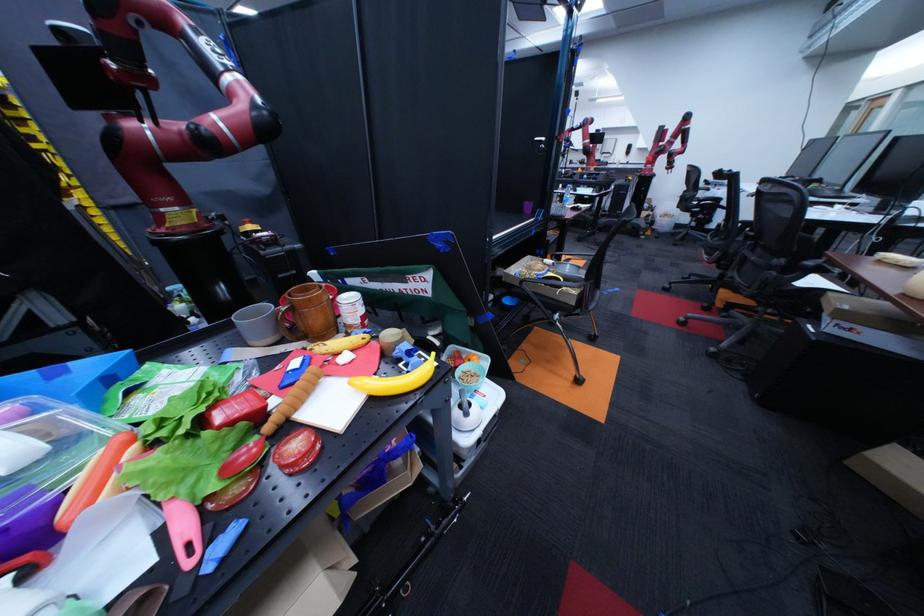
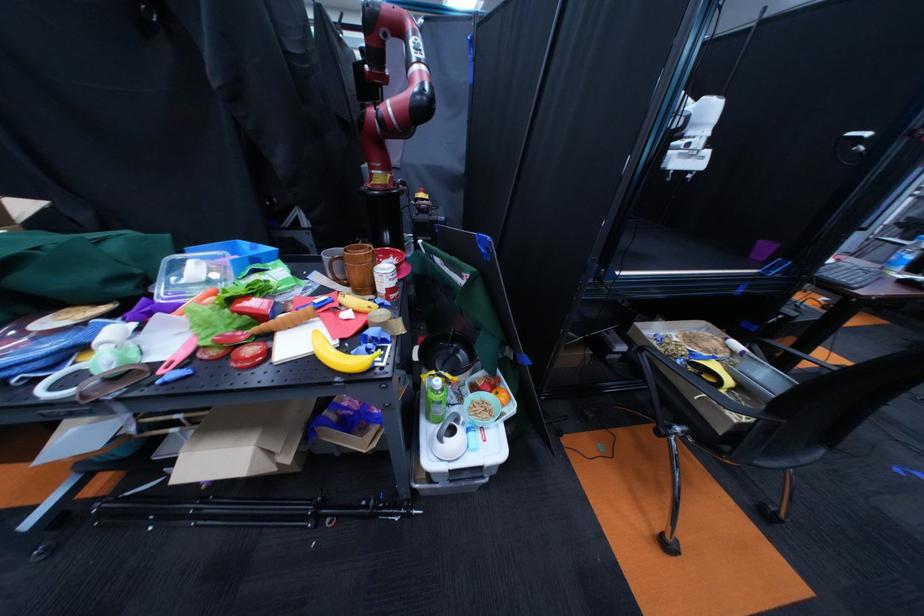
In the second image, find the point that corresponds to point 309,447 in the first image.

(263, 351)